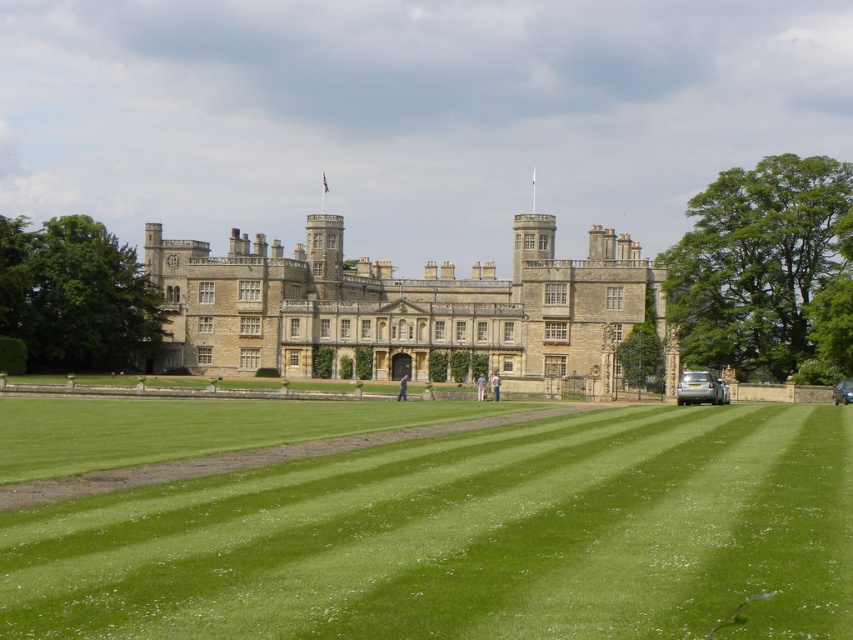
Consider the image. Who is positioned more to the right, beige stone castle at center or blue fabric person at center?

Positioned to the right is beige stone castle at center.

Which of these two, beige stone castle at center or blue fabric person at center, stands shorter?

With less height is blue fabric person at center.

Who is more distant from viewer, (x=616, y=328) or (x=404, y=378)?

The point (x=404, y=378) is behind.

Where is `beige stone castle at center`? This screenshot has height=640, width=853. beige stone castle at center is located at coordinates (401, 307).

Is green grass at center below light brown leather jacket at center?

Yes, green grass at center is below light brown leather jacket at center.

Does green grass at center have a greater height compared to light brown leather jacket at center?

Yes, green grass at center is taller than light brown leather jacket at center.

Is point (683, 410) behind point (495, 400)?

That is False.

Identify the location of green grass at center. (467, 538).

Is light brown leather jacket at center smaller than blue fabric person at center?

Indeed, light brown leather jacket at center has a smaller size compared to blue fabric person at center.

What do you see at coordinates (495, 385) in the screenshot? The height and width of the screenshot is (640, 853). I see `light brown leather jacket at center` at bounding box center [495, 385].

Does point (491, 387) lie in front of point (402, 392)?

No, (491, 387) is further to viewer.

This screenshot has height=640, width=853. What are the coordinates of `light brown leather jacket at center` in the screenshot? It's located at pos(495,385).